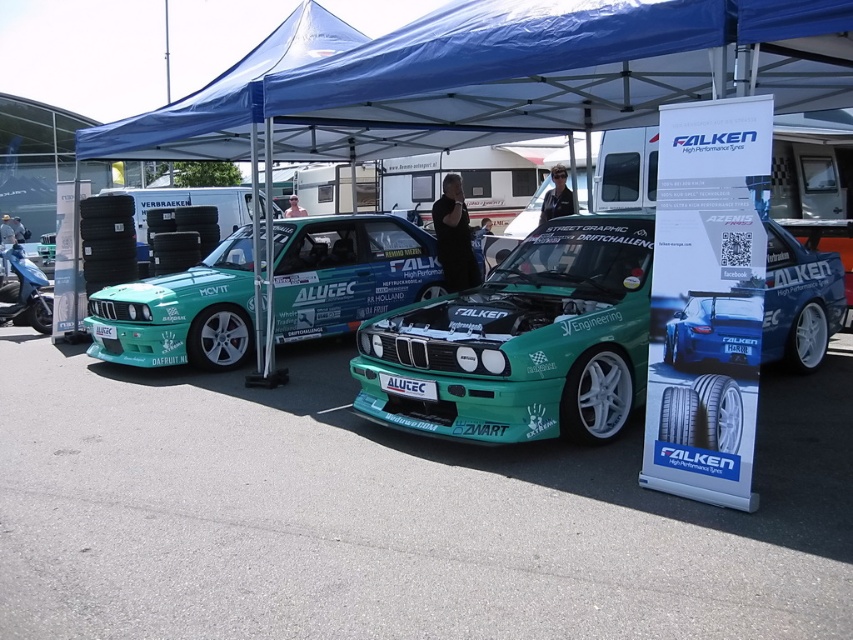
Question: Considering the relative positions of blue glossy car at center and blue metallic scooter at left in the image provided, where is blue glossy car at center located with respect to blue metallic scooter at left?

Choices:
 (A) below
 (B) above

Answer: (A)

Question: Can you confirm if teal glossy car at center is positioned to the right of blue metallic scooter at left?

Choices:
 (A) yes
 (B) no

Answer: (A)

Question: Estimate the real-world distances between objects in this image. Which object is farther from the blue glossy car at center?

Choices:
 (A) blue metallic scooter at left
 (B) teal glossy car at center

Answer: (A)

Question: Is green matte car at center smaller than blue glossy car at center?

Choices:
 (A) no
 (B) yes

Answer: (A)

Question: Which of the following is the farthest from the observer?

Choices:
 (A) pos(132,292)
 (B) pos(36,328)

Answer: (B)

Question: Which point is farther to the camera?

Choices:
 (A) blue fabric canopy at upper center
 (B) blue metallic scooter at left

Answer: (B)